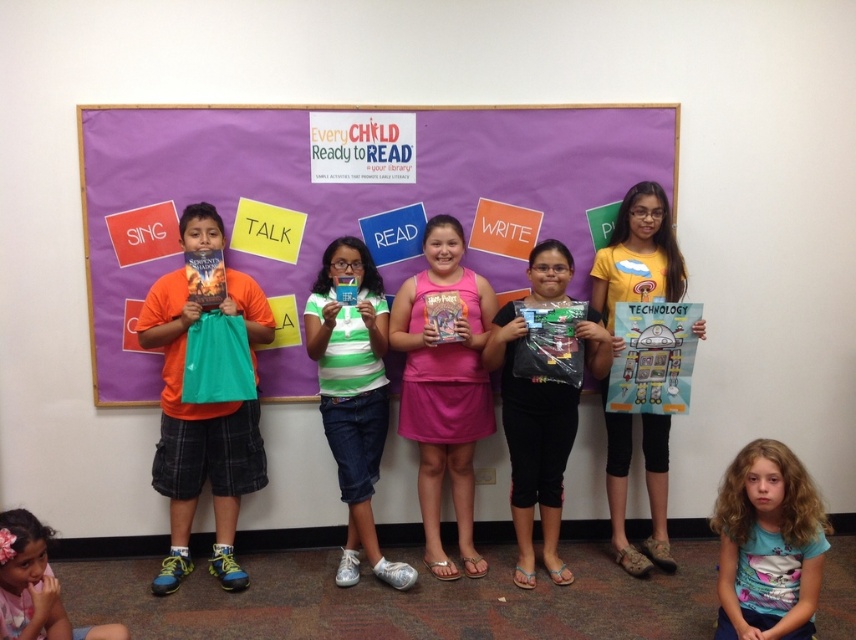
Is orange fabric shirt at left thinner than black matte bag at center?

Incorrect, orange fabric shirt at left's width is not less than black matte bag at center's.

The image size is (856, 640). What do you see at coordinates (197, 442) in the screenshot?
I see `orange fabric shirt at left` at bounding box center [197, 442].

Describe the element at coordinates (197, 442) in the screenshot. I see `orange fabric shirt at left` at that location.

Where is `orange fabric shirt at left`? The width and height of the screenshot is (856, 640). orange fabric shirt at left is located at coordinates 197,442.

From the picture: Is pink fabric dress at center to the right of green striped shirt at center from the viewer's perspective?

Indeed, pink fabric dress at center is positioned on the right side of green striped shirt at center.

Between pink fabric dress at center and green striped shirt at center, which one appears on the left side from the viewer's perspective?

green striped shirt at center is more to the left.

The height and width of the screenshot is (640, 856). Describe the element at coordinates (444, 388) in the screenshot. I see `pink fabric dress at center` at that location.

What are the coordinates of `pink fabric dress at center` in the screenshot? It's located at (444, 388).

Is purple fabric banner at upper center above light blue t-shirt at lower right?

Indeed, purple fabric banner at upper center is positioned over light blue t-shirt at lower right.

Can you confirm if purple fabric banner at upper center is positioned to the left of light blue t-shirt at lower right?

Correct, you'll find purple fabric banner at upper center to the left of light blue t-shirt at lower right.

What do you see at coordinates (342, 202) in the screenshot?
I see `purple fabric banner at upper center` at bounding box center [342, 202].

Where is `purple fabric banner at upper center`? Image resolution: width=856 pixels, height=640 pixels. purple fabric banner at upper center is located at coordinates (342, 202).